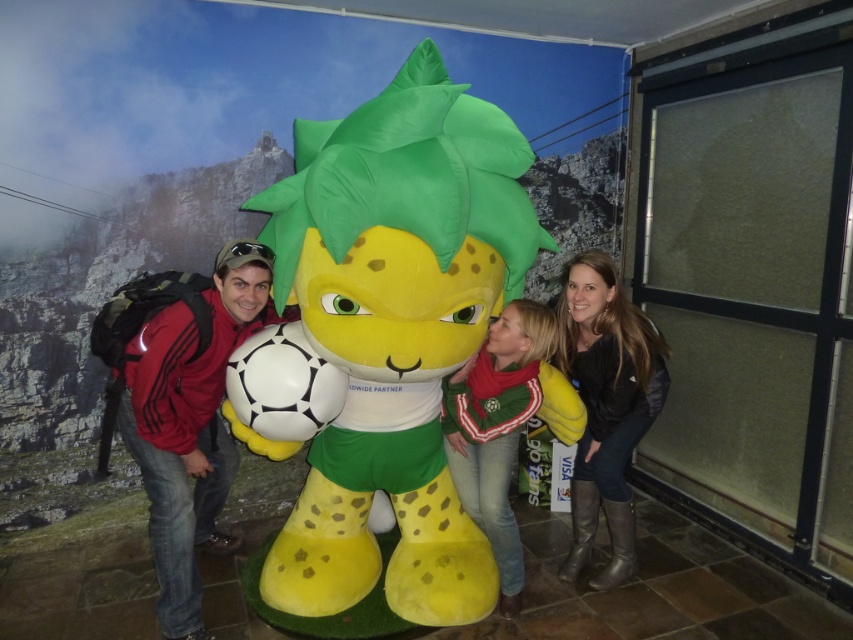
Question: Is matte black jacket at lower right to the right of green jersey at center from the viewer's perspective?

Choices:
 (A) yes
 (B) no

Answer: (A)

Question: Which point is farther to the camera?

Choices:
 (A) (592, 256)
 (B) (498, 317)

Answer: (A)

Question: Among these points, which one is farthest from the camera?

Choices:
 (A) (537, 401)
 (B) (595, 404)

Answer: (B)

Question: Can you confirm if matte black jacket at lower right is bigger than green jersey at center?

Choices:
 (A) yes
 (B) no

Answer: (A)

Question: Can you confirm if matte black jacket at lower right is wider than green jersey at center?

Choices:
 (A) no
 (B) yes

Answer: (B)